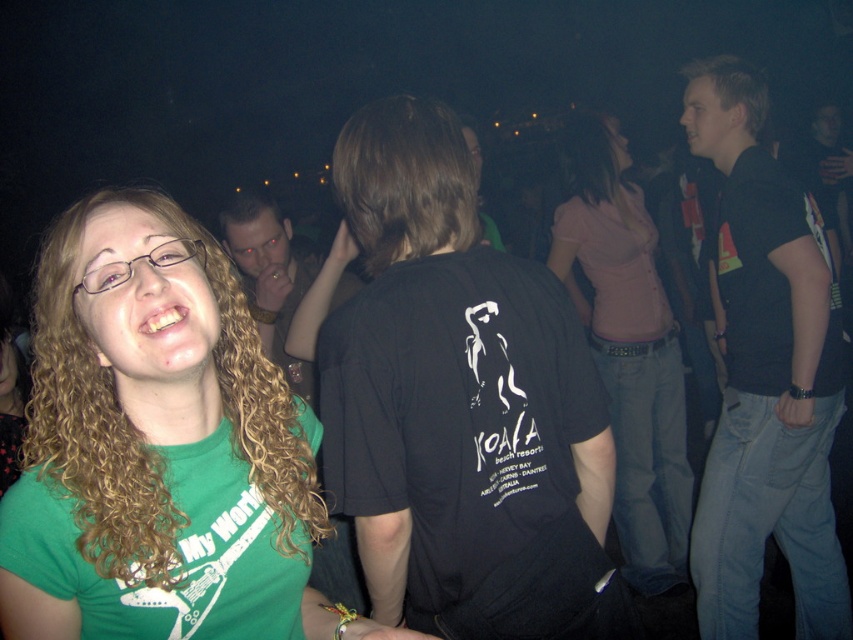
Question: Considering the relative positions of pink fabric shirt at center and brown matte hair at center in the image provided, where is pink fabric shirt at center located with respect to brown matte hair at center?

Choices:
 (A) right
 (B) left

Answer: (A)

Question: Which point is farther to the camera?

Choices:
 (A) (608, 156)
 (B) (442, 156)

Answer: (A)

Question: Which object is positioned farthest from the dark brown hair at center?

Choices:
 (A) brown matte hair at center
 (B) black cotton shirt at right

Answer: (B)

Question: Can you confirm if black cotton t-shirt at center is positioned to the left of pink fabric shirt at center?

Choices:
 (A) no
 (B) yes

Answer: (B)

Question: Which of the following is the closest to the observer?

Choices:
 (A) (270, 209)
 (B) (735, 97)
 (C) (527, 291)
 (D) (375, 122)

Answer: (C)

Question: Is green matte t-shirt at center further to camera compared to brown matte hair at center?

Choices:
 (A) no
 (B) yes

Answer: (A)